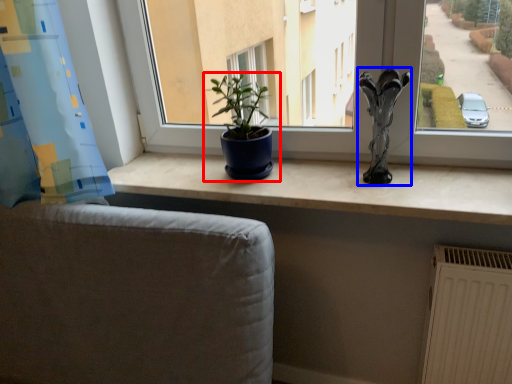
Question: Which point is further to the camera, houseplant (highlighted by a red box) or sculpture (highlighted by a blue box)?

Choices:
 (A) houseplant
 (B) sculpture

Answer: (A)